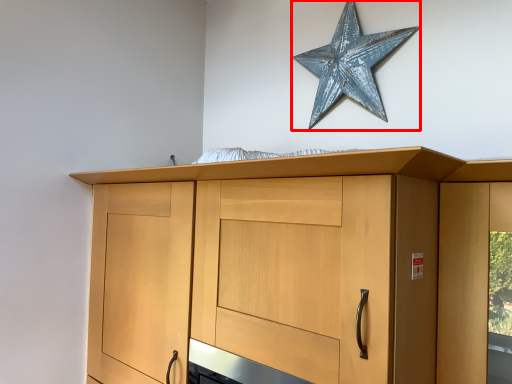
Question: In this image, where is star (annotated by the red box) located relative to cupboard?

Choices:
 (A) right
 (B) left

Answer: (A)